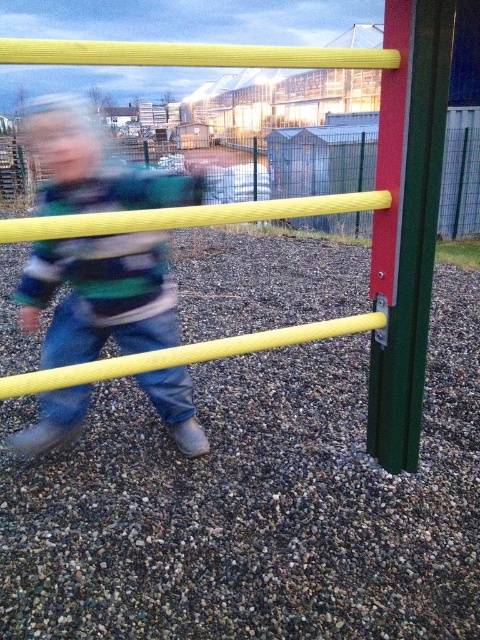
Question: Can you confirm if matte yellow pole at center is positioned below green matte pole at right?

Choices:
 (A) no
 (B) yes

Answer: (A)

Question: Is matte yellow pole at center positioned before green matte pole at right?

Choices:
 (A) no
 (B) yes

Answer: (A)

Question: Which object appears farthest from the camera in this image?

Choices:
 (A) green matte pole at right
 (B) matte yellow pole at center

Answer: (B)

Question: Is matte yellow pole at center below green matte pole at right?

Choices:
 (A) no
 (B) yes

Answer: (A)

Question: Which object is closer to the camera taking this photo?

Choices:
 (A) matte yellow pole at center
 (B) green matte pole at right

Answer: (B)